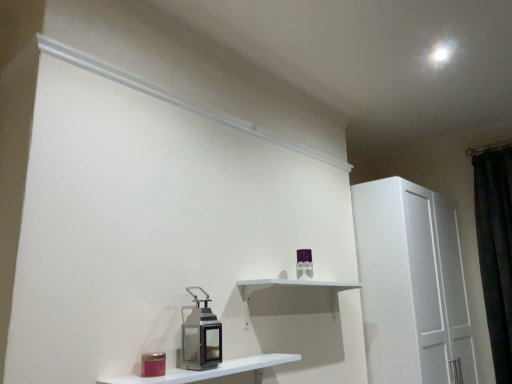
Question: Considering the positions of white matte shelf at center, which is counted as the first shelf, starting from the back, and dark velvet curtain at right in the image, is white matte shelf at center, which is counted as the first shelf, starting from the back, bigger or smaller than dark velvet curtain at right?

Choices:
 (A) small
 (B) big

Answer: (A)

Question: Considering their positions, is white matte shelf at center, which is the second shelf in front-to-back order, located in front of or behind dark velvet curtain at right?

Choices:
 (A) front
 (B) behind

Answer: (A)

Question: Estimate the real-world distances between objects in this image. Which object is farther from the metallic lantern at center?

Choices:
 (A) white matte shelf at center, which is counted as the first shelf, starting from the back
 (B) white glossy shelf at lower center, which ranks as the 2th shelf in back-to-front order
 (C) dark velvet curtain at right

Answer: (C)

Question: Which of these objects is positioned closest to the white glossy shelf at lower center, the first shelf in the front-to-back sequence?

Choices:
 (A) metallic lantern at center
 (B) white matte shelf at center, which is counted as the first shelf, starting from the back
 (C) dark velvet curtain at right

Answer: (A)